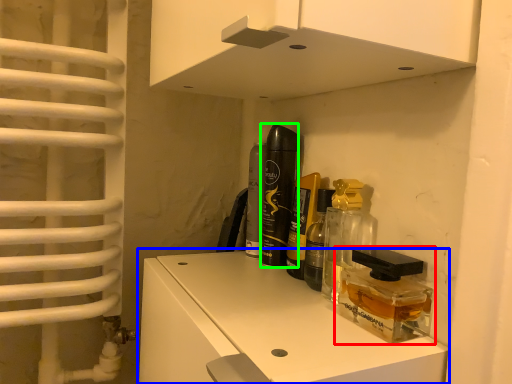
Question: Which is nearer to the product (highlighted by a red box)? cabinetry (highlighted by a blue box) or perfume (highlighted by a green box).

Choices:
 (A) cabinetry
 (B) perfume

Answer: (A)